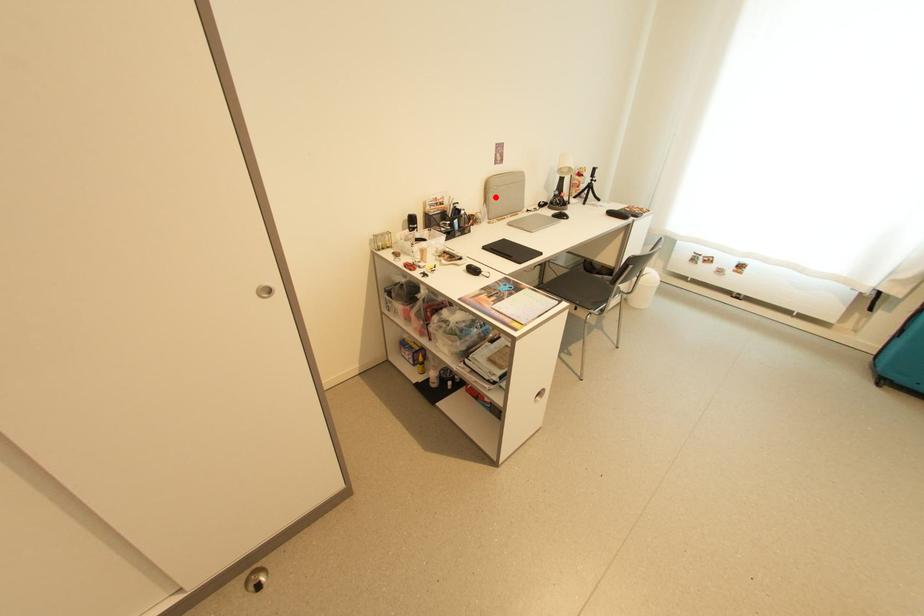
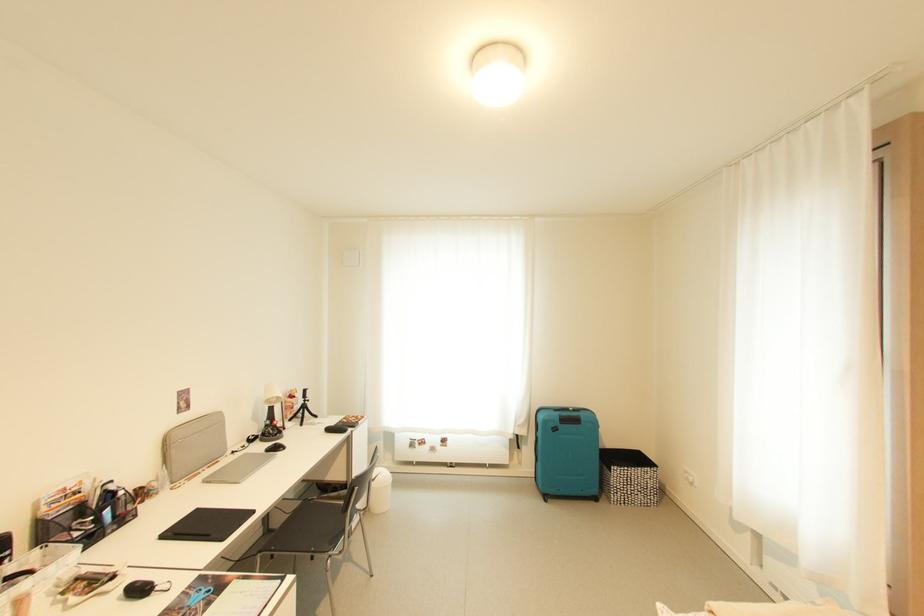
Question: I am providing you with two images of the same scene from different viewpoints. A red point is marked on the first image. Is the red point's position out of view in image 2?

Choices:
 (A) Yes
 (B) No

Answer: (B)